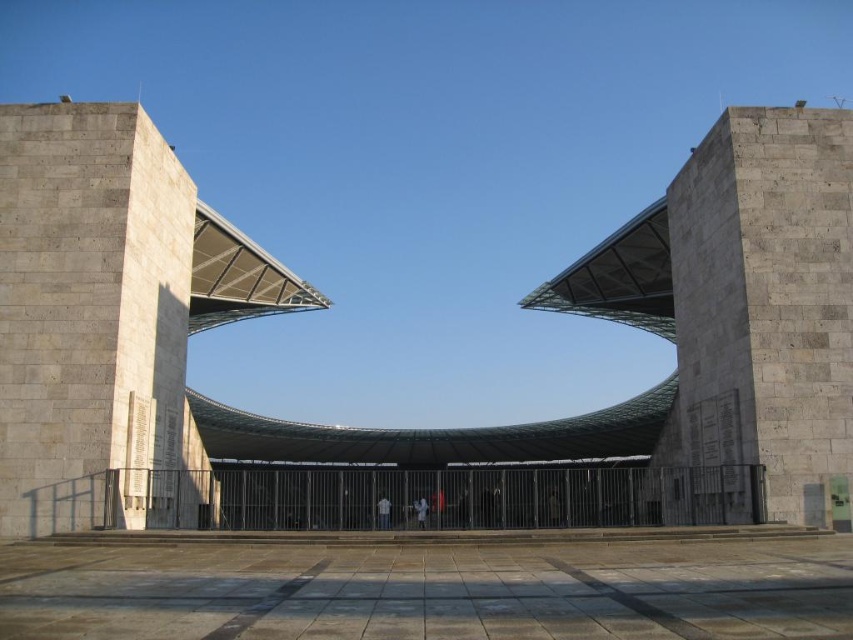
Who is more forward, (665, 269) or (724, 147)?

Point (724, 147) is more forward.

Which is behind, point (706, 289) or point (712, 388)?

Point (706, 289)

Locate an element on the screen. gray stone arch at center is located at coordinates (322, 298).